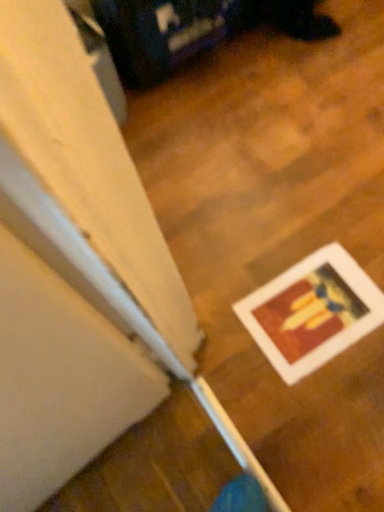
The width and height of the screenshot is (384, 512). What are the coordinates of `blank area to the left of white matte picture frame at lower right` in the screenshot? It's located at (225, 333).